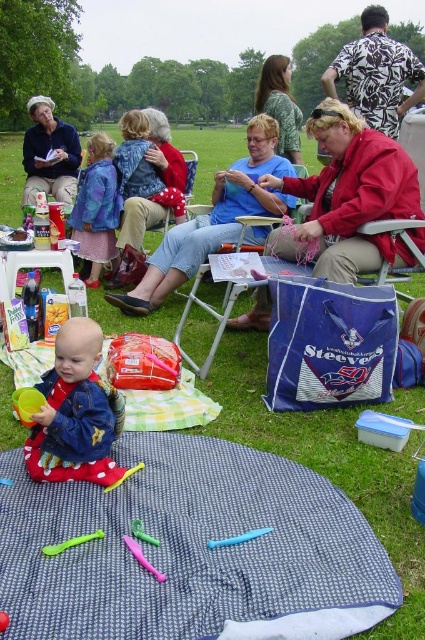
Question: Is red denim jacket at center smaller than pink rubber toy at center?

Choices:
 (A) no
 (B) yes

Answer: (A)

Question: Considering the relative positions of red denim jacket at center and metallic silver chair at center in the image provided, where is red denim jacket at center located with respect to metallic silver chair at center?

Choices:
 (A) below
 (B) above

Answer: (A)

Question: Which point is farther to the camera?

Choices:
 (A) floral shirt at upper right
 (B) blue printed fabric blanket at lower center

Answer: (A)

Question: Which object is closer to the camera taking this photo?

Choices:
 (A) camouflage fabric shirt at center
 (B) floral shirt at upper right

Answer: (B)

Question: Which point is farther from the camera taking this photo?

Choices:
 (A) (258, 534)
 (B) (234, 83)

Answer: (B)

Question: Is blue denim jeans at center bigger than pink plastic crayon at lower center?

Choices:
 (A) no
 (B) yes

Answer: (B)